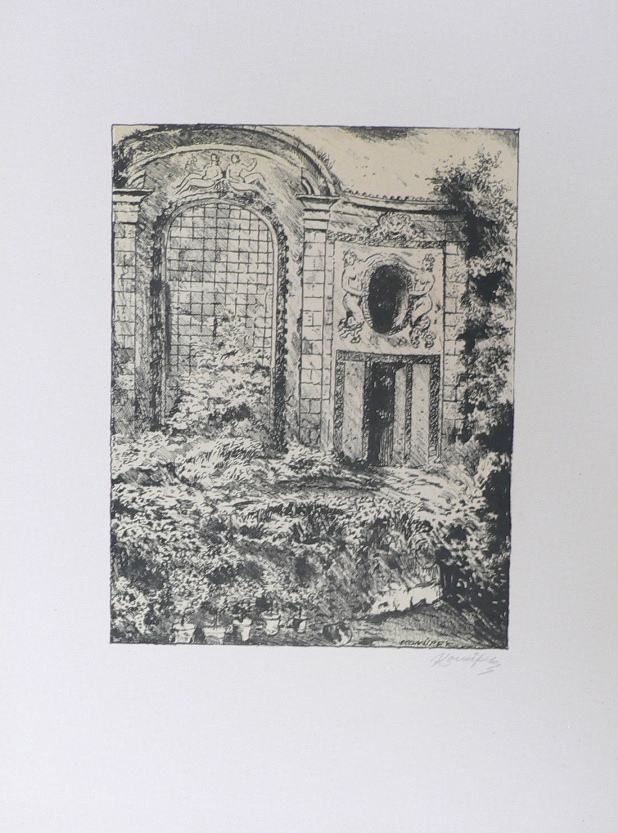
This screenshot has width=618, height=833. Identify the location of plant pot. (180, 631), (218, 634), (246, 626), (272, 624), (298, 622), (337, 626).